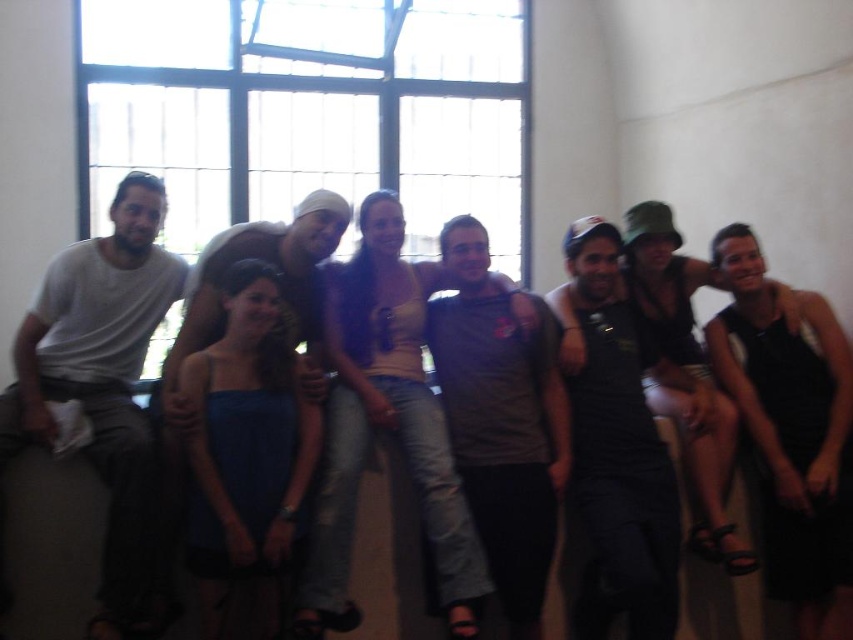
From the picture: You are standing in the room where the group is posing. You need to locate the clear glass window at upper center. Which direction should you look relative to the black matte tank top at center?

The clear glass window at upper center is located to the left of the black matte tank top at center, so you should look to the left of the black matte tank top at center to find it.